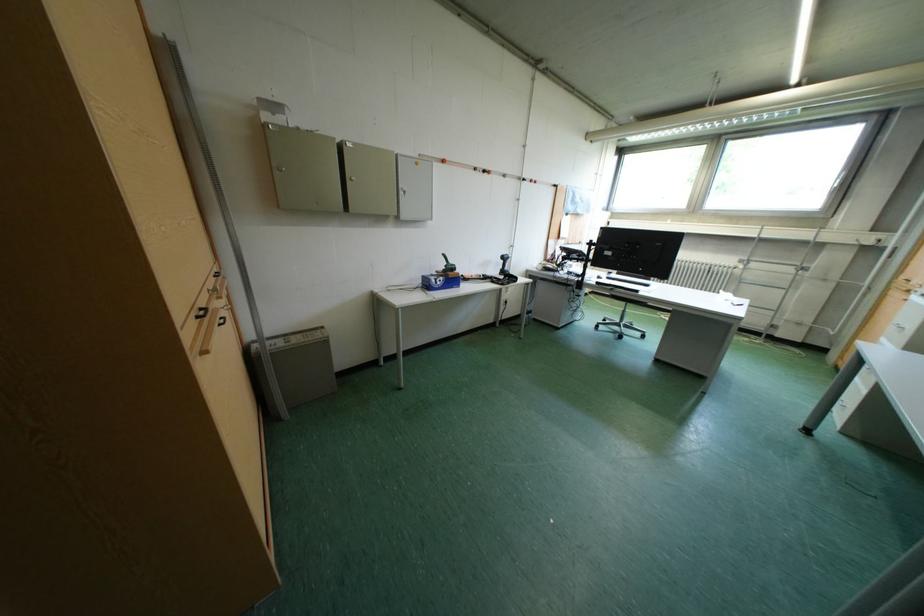
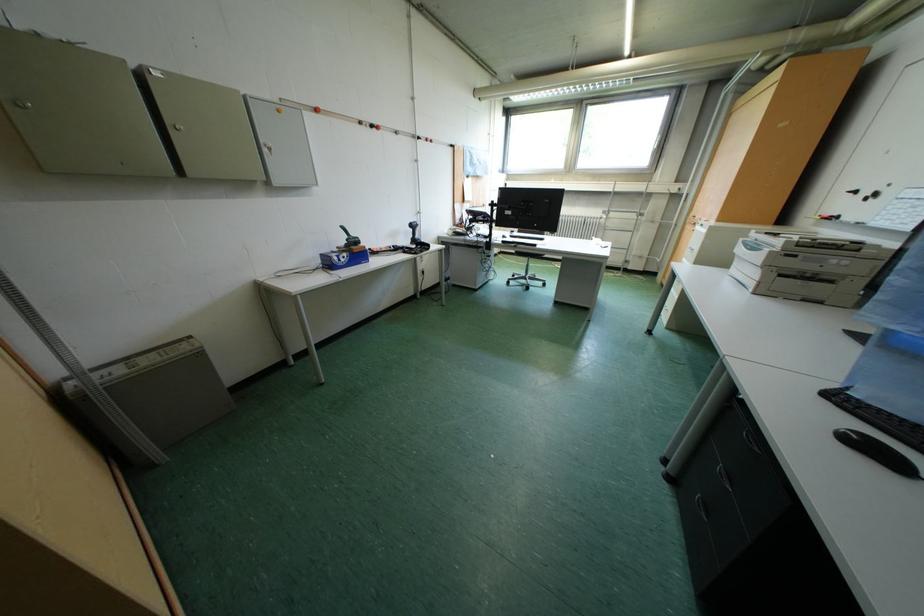
Question: The images are taken continuously from a first-person perspective. In which direction is your viewpoint rotating?

Choices:
 (A) Left
 (B) Right
 (C) Up
 (D) Down

Answer: (B)